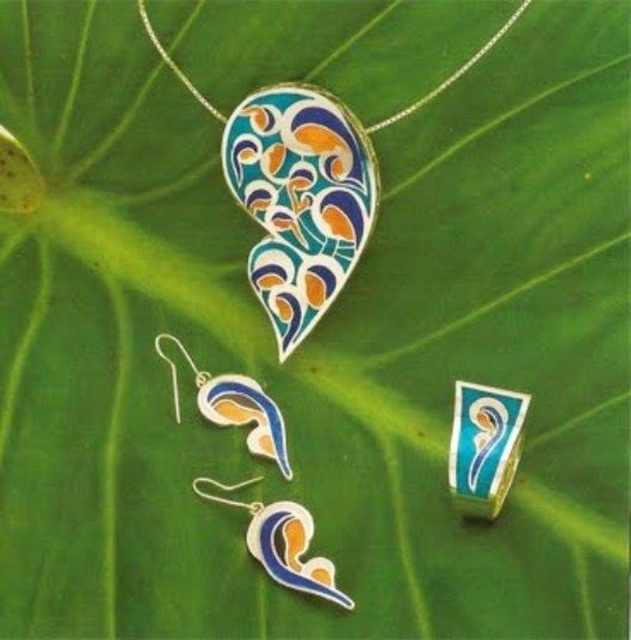
Question: Is matte enamel earring at lower center bigger than enamel pendant at upper center?

Choices:
 (A) no
 (B) yes

Answer: (A)

Question: In this image, where is enamel painted butterfly at center located relative to enamel pendant at upper center?

Choices:
 (A) above
 (B) below

Answer: (B)

Question: Which point is closer to the camera?

Choices:
 (A) (447, 77)
 (B) (293, 108)

Answer: (A)

Question: Among these objects, which one is farthest from the camera?

Choices:
 (A) enamel pendant at upper center
 (B) matte enamel earring at lower center
 (C) enamel painted butterfly at center

Answer: (C)

Question: From the image, what is the correct spatial relationship of matte enamel earring at lower center in relation to enamel pendant at upper center?

Choices:
 (A) right
 (B) left

Answer: (B)

Question: Estimate the real-world distances between objects in this image. Which object is closer to the blue enamel ring at center?

Choices:
 (A) enamel painted butterfly at center
 (B) matte enamel earring at lower center
 (C) enamel pendant at upper center

Answer: (B)